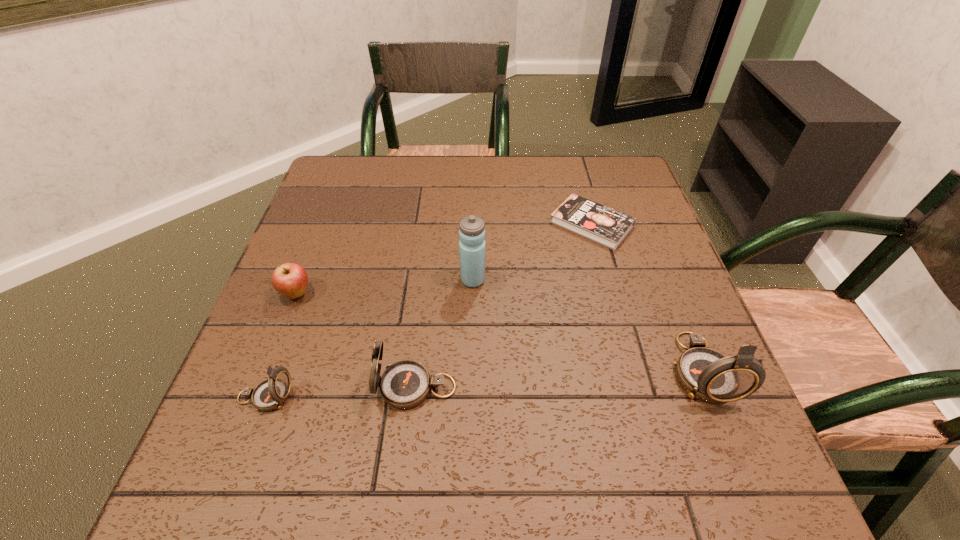
You are a GUI agent. You are given a task and a screenshot of the screen. Output one action in this format:
    pyautogui.click(x=<x>, y=<y>)
    Task: Click on the object that is the fifth closest to the apple
    
    Given the screenshot: What is the action you would take?
    pyautogui.click(x=706, y=374)

Identify which object is located as the fifth nearest to the fourth object from left to right. Please provide its 2D coordinates. Your answer should be formatted as a tuple, i.e. [(x, y)], where the tuple contains the x and y coordinates of a point satisfying the conditions above.

[(270, 394)]

Where is `the second closest compass to the rightmost compass`? The width and height of the screenshot is (960, 540). the second closest compass to the rightmost compass is located at coordinates (270, 394).

Identify which compass is the third closest to the water bottle. Please provide its 2D coordinates. Your answer should be formatted as a tuple, i.e. [(x, y)], where the tuple contains the x and y coordinates of a point satisfying the conditions above.

[(270, 394)]

Find the location of a particular element. The height and width of the screenshot is (540, 960). free location that satisfies the following two spatial constraints: 1. on the face of the rightmost compass; 2. on the face of the second compass from right to left is located at coordinates (708, 387).